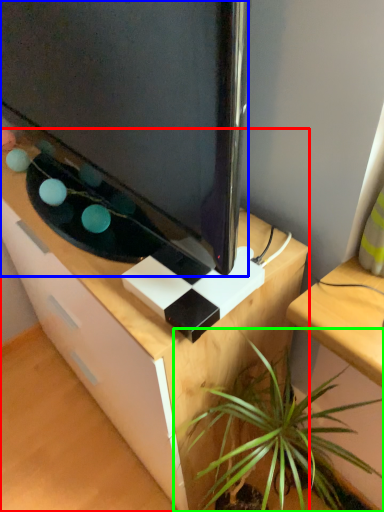
Question: Estimate the real-world distances between objects in this image. Which object is closer to desk (highlighted by a red box), television (highlighted by a blue box) or houseplant (highlighted by a green box)?

Choices:
 (A) television
 (B) houseplant

Answer: (B)